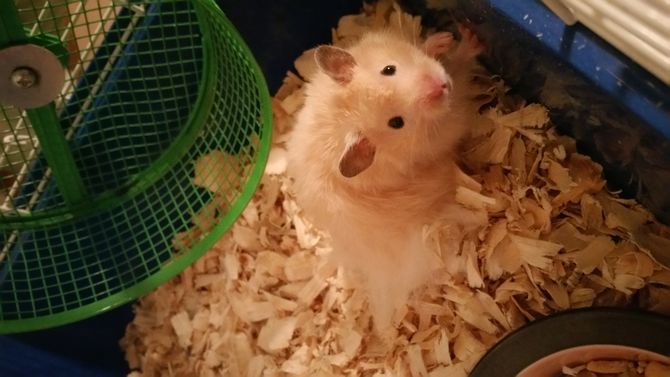
Locate an element on the screen. The height and width of the screenshot is (377, 670). bowl is located at coordinates (601, 359).